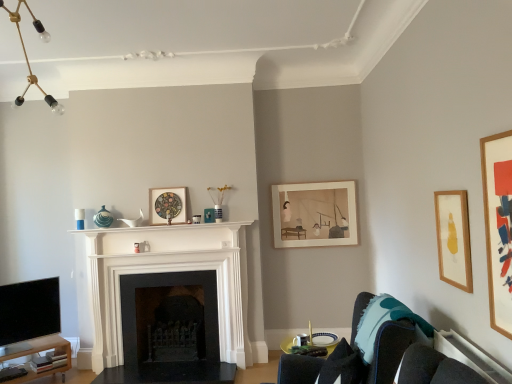
Identify the location of matte paper picture frame at center-right, the 3th picture frame when ordered from right to left. This screenshot has width=512, height=384. (314, 214).

Describe the element at coordinates (387, 320) in the screenshot. This screenshot has height=384, width=512. I see `teal fabric pillow at lower right` at that location.

Where is `gold metallic chandelier at upper left`? gold metallic chandelier at upper left is located at coordinates (27, 56).

Locate an element on the screen. The width and height of the screenshot is (512, 384). black marble table at center, placed as the 2th table when sorted from left to right is located at coordinates (170, 373).

Is gold metallic chandelier at upper left facing towards velvet dark blue couch at lower right?

No, gold metallic chandelier at upper left is not oriented towards velvet dark blue couch at lower right.

Is gold metallic chandelier at upper left wider than velvet dark blue couch at lower right?

In fact, gold metallic chandelier at upper left might be narrower than velvet dark blue couch at lower right.

Can you see gold metallic chandelier at upper left touching velvet dark blue couch at lower right?

No, gold metallic chandelier at upper left is not in contact with velvet dark blue couch at lower right.

From a real-world perspective, is gold metallic chandelier at upper left below velvet dark blue couch at lower right?

No.

Can you confirm if white marble fireplace at center, which ranks as the second fireplace in back-to-front order, is taller than gold metallic chandelier at upper left?

Yes, white marble fireplace at center, which ranks as the second fireplace in back-to-front order, is taller than gold metallic chandelier at upper left.

Does white marble fireplace at center, which ranks as the second fireplace in back-to-front order, come in front of gold metallic chandelier at upper left?

That is False.

From a real-world perspective, is white marble fireplace at center, which ranks as the second fireplace in back-to-front order, positioned over gold metallic chandelier at upper left based on gravity?

No.

Based on the photo, from the image's perspective, would you say white marble fireplace at center, which ranks as the second fireplace in back-to-front order, is shown under gold metallic chandelier at upper left?

Indeed, from the image's perspective, white marble fireplace at center, which ranks as the second fireplace in back-to-front order, is shown beneath gold metallic chandelier at upper left.

From the picture: Would you say black matte fireplace at center, positioned as the first fireplace in back-to-front order, is inside or outside matte paper picture frame at center-right, the 3th picture frame when ordered from right to left?

black matte fireplace at center, positioned as the first fireplace in back-to-front order, exists outside the volume of matte paper picture frame at center-right, the 3th picture frame when ordered from right to left.

Is point (170, 379) positioned in front of point (303, 203)?

That is True.

At what (x,y) coordinates should I click in order to perform the action: click on the 2nd picture frame above the black matte fireplace at center, which is the 2th fireplace in front-to-back order (from the image's perspective). Please return your answer as a coordinate pair (x, y). The height and width of the screenshot is (384, 512). Looking at the image, I should click on (314, 214).

Which object is positioned more to the left, teal fabric pillow at lower right or matte paper picture frame at center-right, the 3th picture frame when ordered from right to left?

From the viewer's perspective, matte paper picture frame at center-right, the 3th picture frame when ordered from right to left, appears more on the left side.

How far apart are teal fabric pillow at lower right and matte paper picture frame at center-right, the 3th picture frame when ordered from right to left?

A distance of 6.30 feet exists between teal fabric pillow at lower right and matte paper picture frame at center-right, the 3th picture frame when ordered from right to left.

Is matte paper picture frame at center-right, which is the first picture frame from back to front, located within teal fabric pillow at lower right?

No.

Does teal fabric pillow at lower right have a smaller size compared to matte paper picture frame at center-right, the fourth picture frame when ordered from front to back?

No, teal fabric pillow at lower right is not smaller than matte paper picture frame at center-right, the fourth picture frame when ordered from front to back.

Is wooden picture frame at right, which is counted as the 3th picture frame, starting from the back, thinner than teal fabric pillow at lower right?

Yes, wooden picture frame at right, which is counted as the 3th picture frame, starting from the back, is thinner than teal fabric pillow at lower right.

Is wooden picture frame at right, acting as the second picture frame starting from the front, to the left or to the right of teal fabric pillow at lower right in the image?

From the image, it's evident that wooden picture frame at right, acting as the second picture frame starting from the front, is to the right of teal fabric pillow at lower right.

How different are the orientations of wooden picture frame at right, acting as the second picture frame starting from the front, and teal fabric pillow at lower right in degrees?

The angle between the facing direction of wooden picture frame at right, acting as the second picture frame starting from the front, and the facing direction of teal fabric pillow at lower right is 2.17 degrees.

What's the angular difference between black glossy tv at lower left and white marble fireplace at center, marked as the first fireplace in a front-to-back arrangement,'s facing directions?

There is a 45.7-degree angle between the facing directions of black glossy tv at lower left and white marble fireplace at center, marked as the first fireplace in a front-to-back arrangement.

Could you tell me if black glossy tv at lower left is facing white marble fireplace at center, marked as the first fireplace in a front-to-back arrangement?

No, black glossy tv at lower left is not facing towards white marble fireplace at center, marked as the first fireplace in a front-to-back arrangement.

Is black glossy tv at lower left located outside white marble fireplace at center, which ranks as the second fireplace in back-to-front order?

That's correct, black glossy tv at lower left is outside of white marble fireplace at center, which ranks as the second fireplace in back-to-front order.

From the image's perspective, is black matte fireplace at center, positioned as the first fireplace in back-to-front order, below velvet dark blue couch at lower right?

Yes.

Is black matte fireplace at center, which is the 2th fireplace in front-to-back order, positioned far away from velvet dark blue couch at lower right?

black matte fireplace at center, which is the 2th fireplace in front-to-back order, is far away from velvet dark blue couch at lower right.

Measure the distance from black matte fireplace at center, which is the 2th fireplace in front-to-back order, to velvet dark blue couch at lower right.

black matte fireplace at center, which is the 2th fireplace in front-to-back order, is 2.51 meters from velvet dark blue couch at lower right.

Identify the location of lamp in front of the velvet dark blue couch at lower right. This screenshot has width=512, height=384. (27, 56).

The width and height of the screenshot is (512, 384). In order to click on the 1st fireplace counting from the right side of the gold metallic chandelier at upper left in this screenshot , I will do `click(159, 272)`.

When comparing their distances from light wood table at lower left, positioned as the 1th table in left-to-right order, does wooden picture frame at center, the 3th picture frame from the front, or teal fabric pillow at lower right seem closer?

Based on the image, wooden picture frame at center, the 3th picture frame from the front, appears to be nearer to light wood table at lower left, positioned as the 1th table in left-to-right order.

Estimate the real-world distances between objects in this image. Which object is further from gold metallic chandelier at upper left, wooden picture frame at center, the 3th picture frame from the front, or black marble table at center, the 1th table viewed from the right?

Based on the image, black marble table at center, the 1th table viewed from the right, appears to be further to gold metallic chandelier at upper left.

Estimate the real-world distances between objects in this image. Which object is closer to wooden picture frame at center, the 2th picture frame viewed from the back, wooden picture frame at right, marked as the 3th picture frame in a left-to-right arrangement, or white glossy mantle at center?

The object closer to wooden picture frame at center, the 2th picture frame viewed from the back, is white glossy mantle at center.

Estimate the real-world distances between objects in this image. Which object is closer to black matte fireplace at center, positioned as the first fireplace in back-to-front order, velvet dark blue couch at lower right or white marble fireplace at center, which ranks as the second fireplace in back-to-front order?

white marble fireplace at center, which ranks as the second fireplace in back-to-front order, is closer to black matte fireplace at center, positioned as the first fireplace in back-to-front order.

From the picture: From the image, which object appears to be farther from gold metallic chandelier at upper left, velvet dark blue couch at lower right or white marble fireplace at center, marked as the first fireplace in a front-to-back arrangement?

Based on the image, velvet dark blue couch at lower right appears to be further to gold metallic chandelier at upper left.

Based on their spatial positions, is wooden picture frame at right, which is counted as the 3th picture frame, starting from the back, or black matte fireplace at center, positioned as the first fireplace in back-to-front order, further from black glossy tv at lower left?

wooden picture frame at right, which is counted as the 3th picture frame, starting from the back, lies further to black glossy tv at lower left than the other object.

Looking at the image, which one is located further to white marble fireplace at center, which ranks as the second fireplace in back-to-front order, wooden picture frame at right, which is counted as the 3th picture frame, starting from the back, or velvet dark blue couch at lower right?

wooden picture frame at right, which is counted as the 3th picture frame, starting from the back, is positioned further to the anchor white marble fireplace at center, which ranks as the second fireplace in back-to-front order.

Estimate the real-world distances between objects in this image. Which object is closer to light wood table at lower left, positioned as the 1th table in left-to-right order, white glossy mantle at center or wooden picture frame at right, which is counted as the second picture frame, starting from the right?

The object closer to light wood table at lower left, positioned as the 1th table in left-to-right order, is white glossy mantle at center.

This screenshot has height=384, width=512. What are the coordinates of `table between wooden picture frame at center, the 4th picture frame from the right, and wooden picture frame at right, which appears as the 4th picture frame when viewed from the left, in the horizontal direction` in the screenshot? It's located at (170, 373).

You are a GUI agent. You are given a task and a screenshot of the screen. Output one action in this format:
    pyautogui.click(x=<x>, y=<y>)
    Task: Click on the picture frame between velvet dark blue couch at lower right and white marble fireplace at center, which ranks as the second fireplace in back-to-front order, in the front-back direction
    This screenshot has height=384, width=512.
    Given the screenshot: What is the action you would take?
    pyautogui.click(x=453, y=238)

Where is `pillow between gold metallic chandelier at upper left and wooden picture frame at center, the 2th picture frame viewed from the back, along the z-axis`? pillow between gold metallic chandelier at upper left and wooden picture frame at center, the 2th picture frame viewed from the back, along the z-axis is located at coordinates (387, 320).

Find the location of `mantle positioned between gold metallic chandelier at upper left and matte paper picture frame at center-right, the second picture frame viewed from the left, from near to far`. mantle positioned between gold metallic chandelier at upper left and matte paper picture frame at center-right, the second picture frame viewed from the left, from near to far is located at coordinates (163, 228).